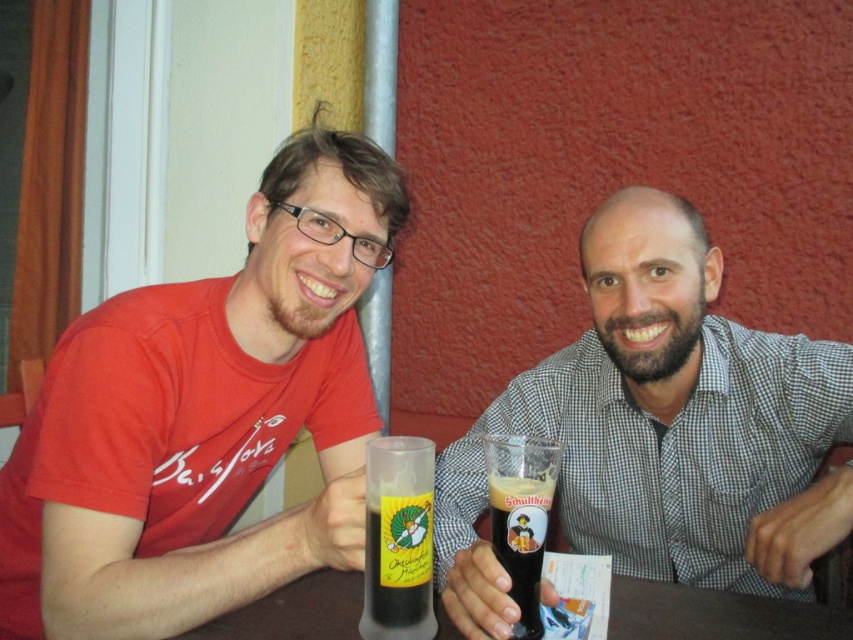
Question: Can you confirm if translucent glass bottle at center is smaller than dark brown glass at center?

Choices:
 (A) no
 (B) yes

Answer: (B)

Question: Among these objects, which one is farthest from the camera?

Choices:
 (A) matte glass beer at center
 (B) translucent plastic table at center

Answer: (B)

Question: Can you confirm if matte glass beer at center is bigger than translucent plastic table at center?

Choices:
 (A) no
 (B) yes

Answer: (B)

Question: Which object is closer to the camera taking this photo?

Choices:
 (A) matte plastic cup at center
 (B) translucent plastic table at center
 (C) matte glass beer at center

Answer: (C)

Question: Is matte plastic cup at center bigger than translucent glass bottle at center?

Choices:
 (A) no
 (B) yes

Answer: (B)

Question: Which point is closer to the camera?

Choices:
 (A) (410, 518)
 (B) (210, 374)
 (C) (810, 616)

Answer: (A)